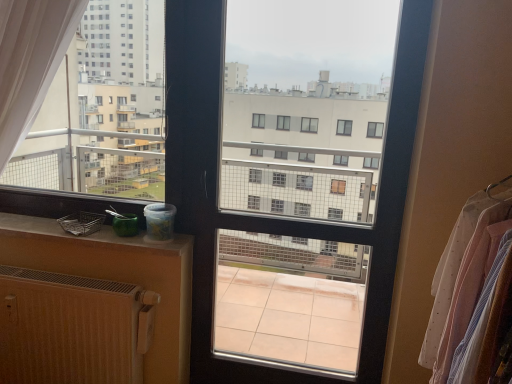
Question: Is clear glass window screen at center oriented towards matte plastic container at lower left?

Choices:
 (A) no
 (B) yes

Answer: (A)

Question: Is clear glass window screen at center shorter than matte plastic container at lower left?

Choices:
 (A) no
 (B) yes

Answer: (A)

Question: Is clear glass window screen at center oriented away from matte plastic container at lower left?

Choices:
 (A) no
 (B) yes

Answer: (A)

Question: Can you confirm if clear glass window screen at center is thinner than matte plastic container at lower left?

Choices:
 (A) no
 (B) yes

Answer: (B)

Question: Can you confirm if clear glass window screen at center is smaller than matte plastic container at lower left?

Choices:
 (A) yes
 (B) no

Answer: (B)

Question: From the image's perspective, is wooden radiator at lower left positioned above or below matte plastic container at lower left?

Choices:
 (A) below
 (B) above

Answer: (A)

Question: From a real-world perspective, is wooden radiator at lower left above or below matte plastic container at lower left?

Choices:
 (A) below
 (B) above

Answer: (A)

Question: Is wooden radiator at lower left inside the boundaries of matte plastic container at lower left, or outside?

Choices:
 (A) inside
 (B) outside

Answer: (B)

Question: Based on their sizes in the image, would you say wooden radiator at lower left is bigger or smaller than matte plastic container at lower left?

Choices:
 (A) big
 (B) small

Answer: (A)

Question: From a real-world perspective, is clear glass window screen at center above or below matte plastic container at lower left?

Choices:
 (A) above
 (B) below

Answer: (A)

Question: Is clear glass window screen at center bigger or smaller than matte plastic container at lower left?

Choices:
 (A) small
 (B) big

Answer: (B)

Question: In the image, is clear glass window screen at center positioned in front of or behind matte plastic container at lower left?

Choices:
 (A) behind
 (B) front

Answer: (B)

Question: Is clear glass window screen at center inside or outside of matte plastic container at lower left?

Choices:
 (A) inside
 (B) outside

Answer: (B)

Question: In the image, is white sheer fabric at right positioned in front of or behind clear glass window screen at center?

Choices:
 (A) behind
 (B) front

Answer: (B)

Question: Which is correct: white sheer fabric at right is inside clear glass window screen at center, or outside of it?

Choices:
 (A) inside
 (B) outside

Answer: (B)